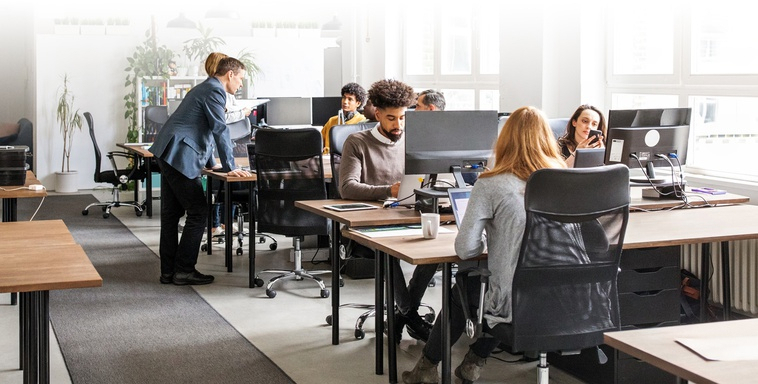
At what (x,y) coordinates should I click in order to perform the action: click on table. Please return your answer as a coordinate pair (x, y). This screenshot has height=384, width=758. Looking at the image, I should click on (29, 277), (8, 191), (145, 145), (236, 174), (352, 200), (396, 240), (637, 338).